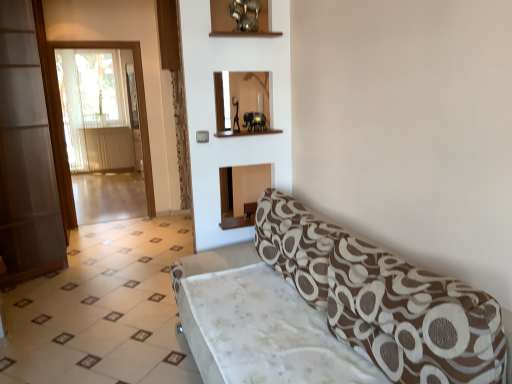
Question: Does transparent glass screen door at left, placed as the second screen door when sorted from back to front, have a greater width compared to brown textured fabric studio couch at lower right?

Choices:
 (A) yes
 (B) no

Answer: (B)

Question: Is transparent glass screen door at left, which appears as the 1th screen door when viewed from the front, at the left side of brown textured fabric studio couch at lower right?

Choices:
 (A) no
 (B) yes

Answer: (B)

Question: Could you tell me if transparent glass screen door at left, which appears as the 1th screen door when viewed from the front, is facing brown textured fabric studio couch at lower right?

Choices:
 (A) no
 (B) yes

Answer: (A)

Question: Considering the relative sizes of transparent glass screen door at left, placed as the second screen door when sorted from back to front, and brown textured fabric studio couch at lower right in the image provided, is transparent glass screen door at left, placed as the second screen door when sorted from back to front, taller than brown textured fabric studio couch at lower right?

Choices:
 (A) no
 (B) yes

Answer: (B)

Question: Is the position of transparent glass screen door at left, placed as the second screen door when sorted from back to front, less distant than that of brown textured fabric studio couch at lower right?

Choices:
 (A) no
 (B) yes

Answer: (A)

Question: From a real-world perspective, is transparent glass screen door at left, placed as the second screen door when sorted from back to front, physically above brown textured fabric studio couch at lower right?

Choices:
 (A) no
 (B) yes

Answer: (B)

Question: From a real-world perspective, is brown textured fabric studio couch at lower right below transparent glass screen door at left, placed as the second screen door when sorted from back to front?

Choices:
 (A) yes
 (B) no

Answer: (A)

Question: Can you confirm if brown textured fabric studio couch at lower right is thinner than transparent glass screen door at left, which appears as the 1th screen door when viewed from the front?

Choices:
 (A) yes
 (B) no

Answer: (B)

Question: Does brown textured fabric studio couch at lower right have a smaller size compared to transparent glass screen door at left, placed as the second screen door when sorted from back to front?

Choices:
 (A) no
 (B) yes

Answer: (B)

Question: Is brown textured fabric studio couch at lower right beside transparent glass screen door at left, which appears as the 1th screen door when viewed from the front?

Choices:
 (A) no
 (B) yes

Answer: (A)

Question: From the image's perspective, is brown textured fabric studio couch at lower right below transparent glass screen door at left, which appears as the 1th screen door when viewed from the front?

Choices:
 (A) no
 (B) yes

Answer: (B)

Question: Considering the relative sizes of brown textured fabric studio couch at lower right and transparent glass screen door at left, placed as the second screen door when sorted from back to front, in the image provided, is brown textured fabric studio couch at lower right shorter than transparent glass screen door at left, placed as the second screen door when sorted from back to front,?

Choices:
 (A) yes
 (B) no

Answer: (A)

Question: Is transparent glass screen door at left, the 2th screen door in the front-to-back sequence, positioned beyond the bounds of white glossy tile at lower left?

Choices:
 (A) no
 (B) yes

Answer: (B)